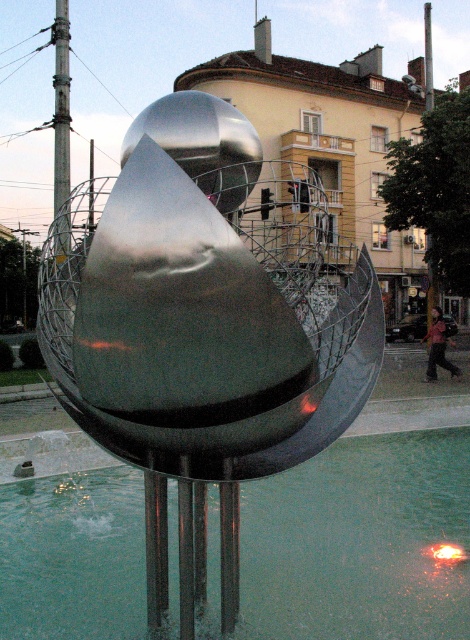
Question: Which point appears farthest from the camera in this image?

Choices:
 (A) (86, 196)
 (B) (397, 461)

Answer: (B)

Question: Which point appears farthest from the camera in this image?

Choices:
 (A) (280, 369)
 (B) (55, 513)

Answer: (B)

Question: In this image, where is shiny metallic sculpture at center located relative to clear glass water at center?

Choices:
 (A) right
 (B) left

Answer: (A)

Question: Is shiny metallic sculpture at center positioned at the back of clear glass water at center?

Choices:
 (A) yes
 (B) no

Answer: (B)

Question: Which point is farther to the camera?

Choices:
 (A) (428, 624)
 (B) (233, 268)

Answer: (A)

Question: Can you confirm if shiny metallic sculpture at center is positioned above clear glass water at center?

Choices:
 (A) yes
 (B) no

Answer: (A)